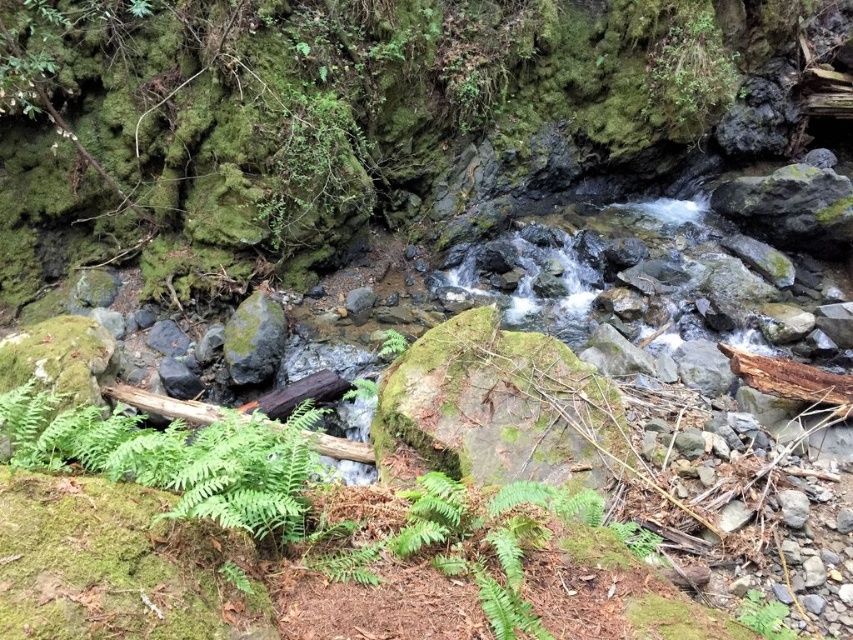
You are a hiker who wants to place a small, 10 cm wide decorative stone between the green matte fern at lower left and the green mossy rock at center. Based on their sizes, which object should you place the stone closer to?

The green mossy rock at center is smaller in size compared to the green matte fern at lower left. Therefore, you should place the stone closer to the green mossy rock at center to ensure it is not overshadowed by the larger fern.

You are standing at the edge of the stream and want to place a small decorative stone exactly at the center of the stream. The center of the stream is defined as the point where the green mossy rock at center is located. What are the coordinates of the point where you should place the stone?

The coordinates for the center of the stream where the green mossy rock at center is located are at point (254, 339).

You are a hiker who wants to place a small decorative rock between the green matte fern at lower left and the green matte fern at lower right. Which fern should you place the rock closer to if you want the rock to be closer to the shorter fern?

The green matte fern at lower right is shorter than the green matte fern at lower left. Therefore, to place the rock closer to the shorter fern, you should position it nearer to the green matte fern at lower right.